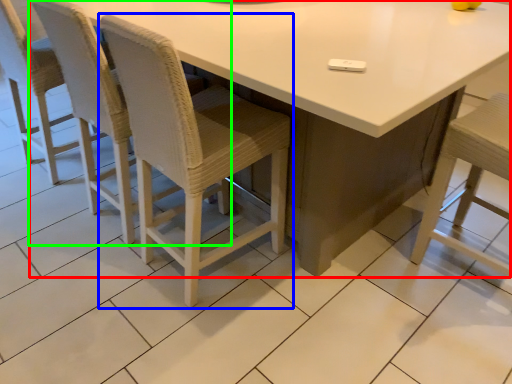
Question: Which object is positioned closest to table (highlighted by a red box)? Select from chair (highlighted by a blue box) and chair (highlighted by a green box).

Choices:
 (A) chair
 (B) chair

Answer: (A)